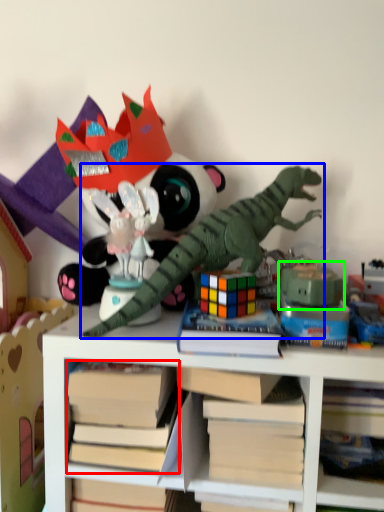
Question: Considering the real-world distances, which object is closest to book (highlighted by a red box)? toy (highlighted by a blue box) or toy (highlighted by a green box).

Choices:
 (A) toy
 (B) toy

Answer: (A)